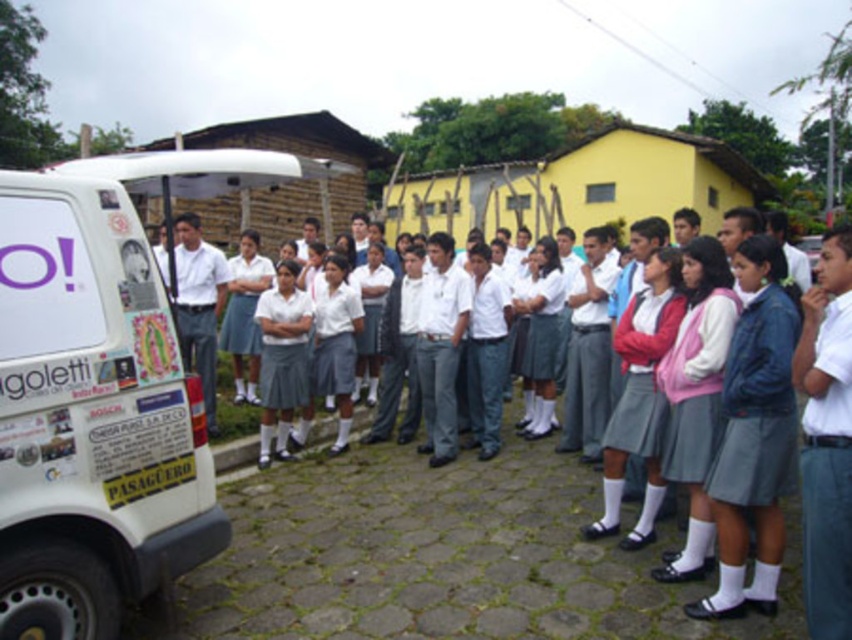
Based on the photo, you are standing in the rural area where the students are gathered. You want to approach the white matte van at left to ask for directions. Considering the distance, is it feasible to walk to the van without any obstacles?

The white matte van at left is 9.23 feet away from the viewer, so yes, it is feasible to walk to the van without any obstacles as the distance is relatively short.

You are a photographer trying to capture a clear photo of the white cotton shirt at center. However, the white matte van at left is blocking your view. Can you move around to the right side of the van to get an unobstructed shot?

The white matte van at left is in front of the white cotton shirt at center, so moving to the right side of the van might allow you to see around it and capture the white cotton shirt at center without obstruction.

You are a photographer trying to capture a group photo of the students without including the white matte van at left. Based on the scene, where should you position yourself to ensure the van is out of frame?

Position yourself to the right side of the scene so that the white matte van at left is out of the frame.